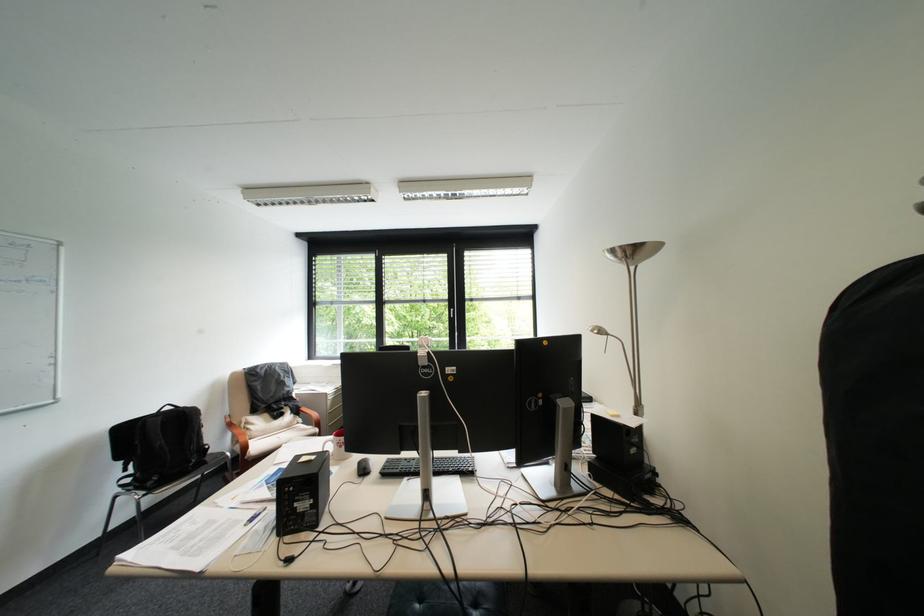
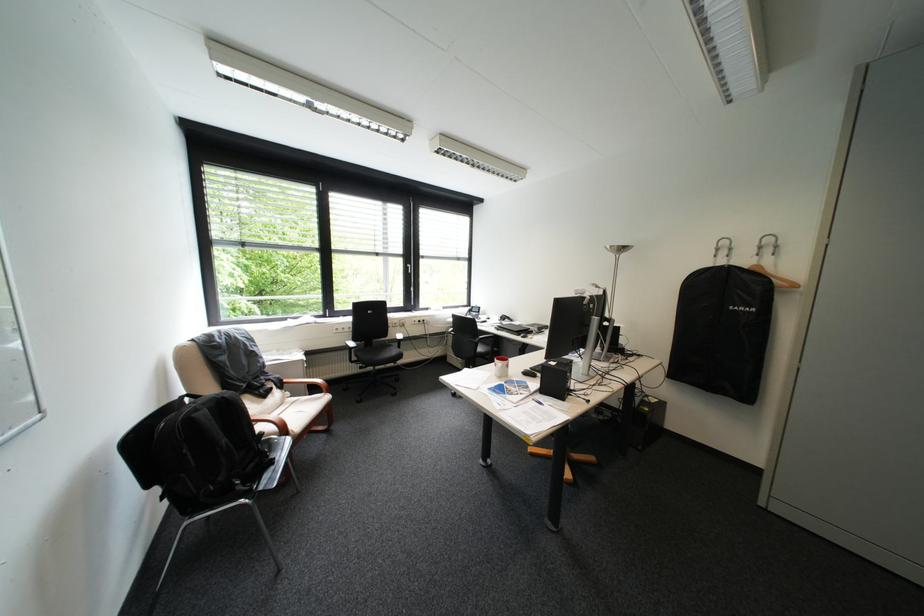
Find the pixel in the second image that matches (x=198, y=411) in the first image.

(236, 398)